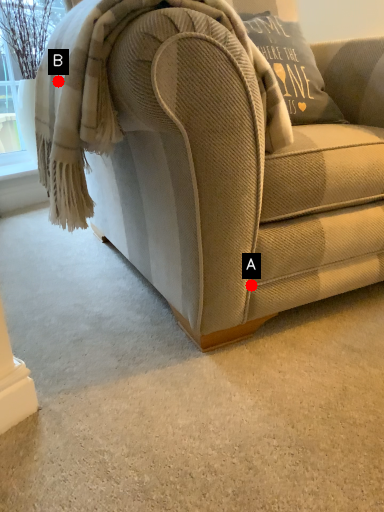
Question: Two points are circled on the image, labeled by A and B beside each circle. Which point appears farthest from the camera in this image?

Choices:
 (A) A is further
 (B) B is further

Answer: (A)